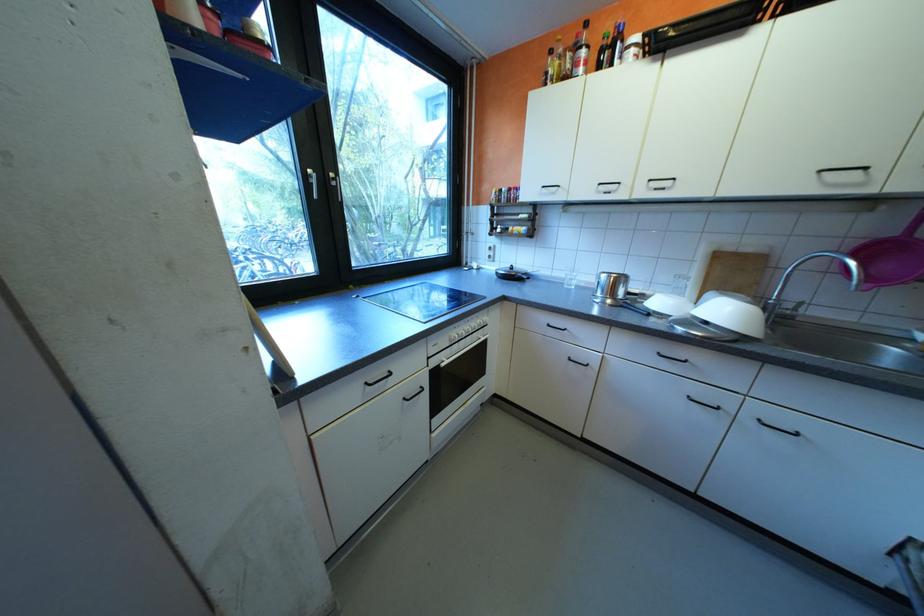
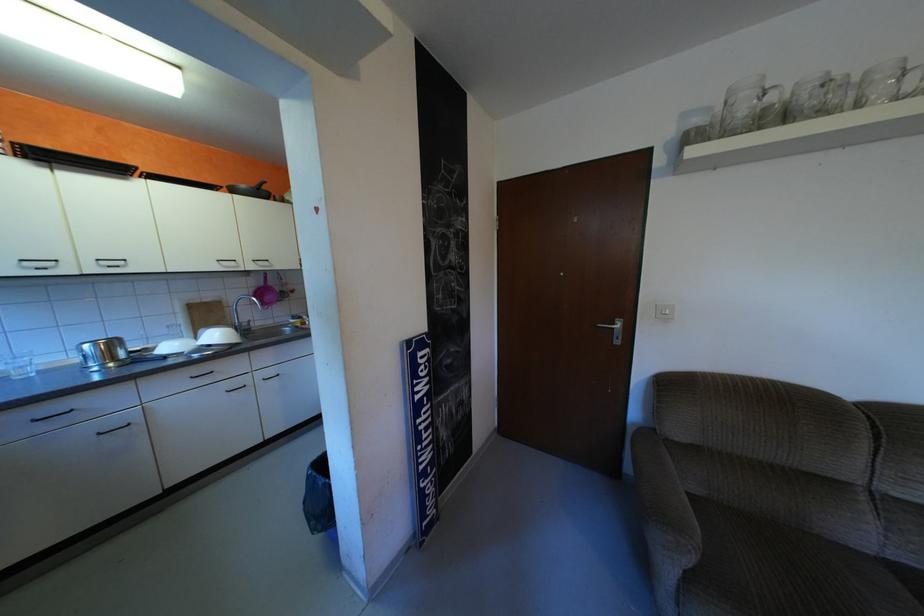
Question: The images are taken continuously from a first-person perspective. In which direction is your viewpoint rotating?

Choices:
 (A) Left
 (B) Right
 (C) Up
 (D) Down

Answer: (B)